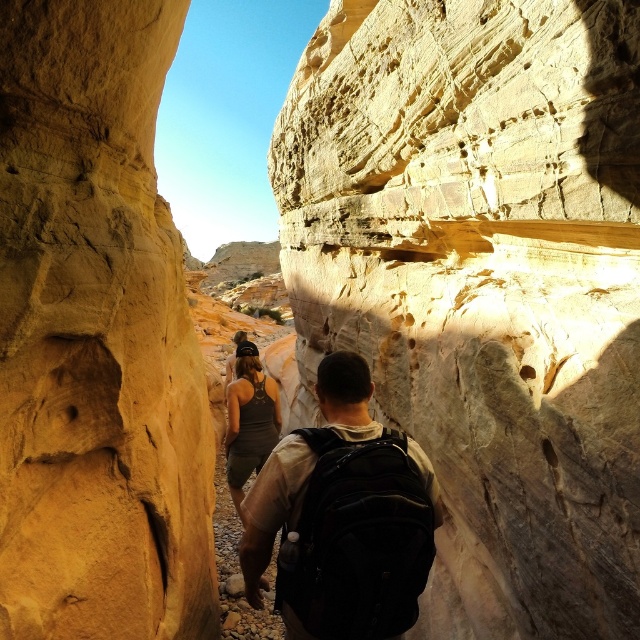
You are a hiker trying to navigate through the canyon. You have two reference points marked on your map as point 1 at coordinates (316, 260) and point 2 at coordinates (124, 209). Which point is closer to your current position if you are standing at the starting point of the trail?

Point 1 at coordinates (316, 260) is closer to your current position because it is further to the viewer compared to point 2 at coordinates (124, 209).

In the scene shown: You are a hiker who wants to take a photo of the matte black backpack at center without the matte sandstone rock face at center blocking the view. Is this possible from your current position?

The matte sandstone rock face at center is closer to you than the matte black backpack at center, so you cannot take a photo of the matte black backpack at center without the matte sandstone rock face at center blocking the view.

You are a hiker planning to pass through the narrow canyon. You notice the matte sandstone rock face at center and the matte black backpack at center. Which object is bigger in size?

The matte sandstone rock face at center is larger in size than the matte black backpack at center.